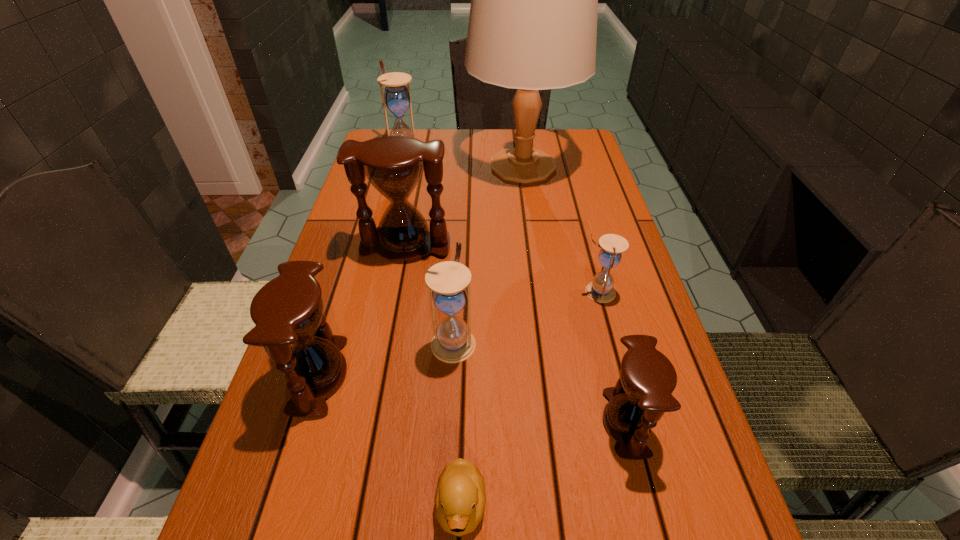
Image resolution: width=960 pixels, height=540 pixels. Identify the location of beige table lamp. (534, 0).

This screenshot has width=960, height=540. I want to click on table lamp, so click(534, 0).

This screenshot has height=540, width=960. I want to click on the biggest white hourglass, so click(x=396, y=97).

The height and width of the screenshot is (540, 960). What are the coordinates of `the farthest white hourglass` in the screenshot? It's located at (396, 97).

Image resolution: width=960 pixels, height=540 pixels. I want to click on the biggest brown hourglass, so click(x=393, y=165).

You are a GUI agent. You are given a task and a screenshot of the screen. Output one action in this format:
    pyautogui.click(x=<x>, y=<y>)
    Task: Click on the farthest brown hourglass
    The height and width of the screenshot is (540, 960).
    Given the screenshot: What is the action you would take?
    pyautogui.click(x=393, y=165)

Find the location of a particular element. The image size is (960, 540). the second biggest brown hourglass is located at coordinates (287, 310).

In order to click on the nearest white hourglass in this screenshot , I will do `click(453, 342)`.

What are the coordinates of `the second smallest white hourglass` in the screenshot? It's located at (453, 342).

Where is `the smallest white hourglass`? The width and height of the screenshot is (960, 540). the smallest white hourglass is located at coordinates (601, 290).